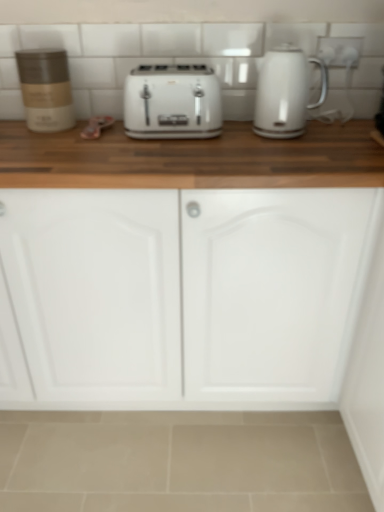
Image resolution: width=384 pixels, height=512 pixels. What are the coordinates of `vacant area situated to the left side of white glossy electric kettle at upper right` in the screenshot? It's located at (236, 140).